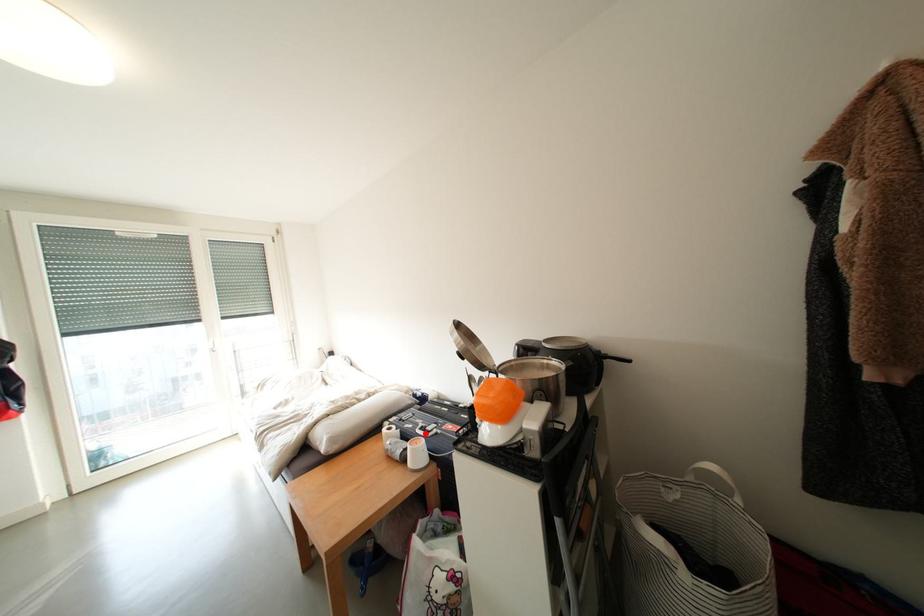
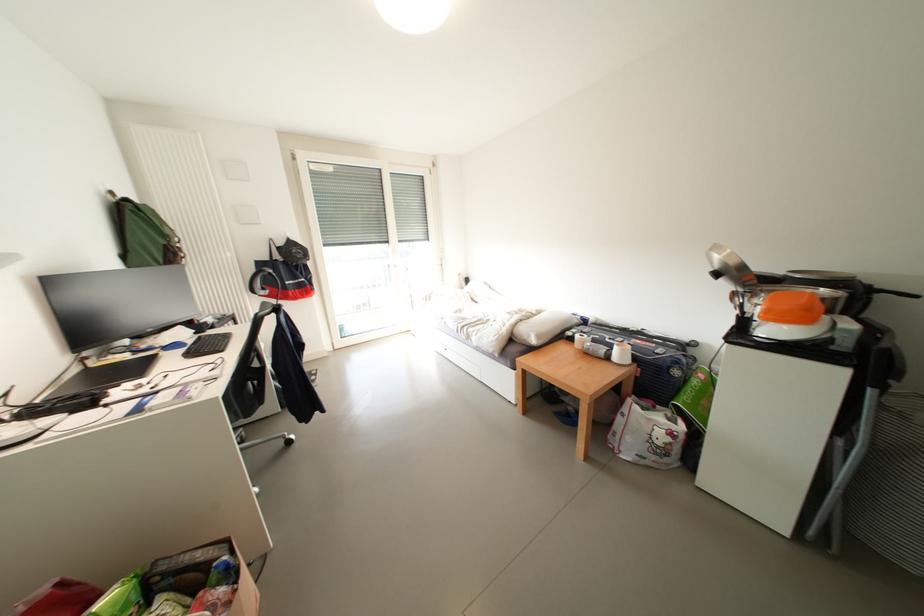
Question: A red point is marked in image1. In image2, is the corresponding 3D point closer to the camera or farther? Reply with the corresponding letter.

Choices:
 (A) The corresponding 3D point is closer.
 (B) The corresponding 3D point is farther.

Answer: (B)